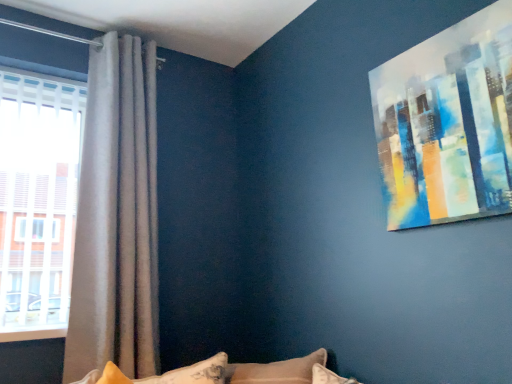
Question: Would you say acrylic painting at upper right is to the left or to the right of fluffy white pillow at lower center in the picture?

Choices:
 (A) left
 (B) right

Answer: (B)

Question: From the image's perspective, is acrylic painting at upper right located above or below fluffy white pillow at lower center?

Choices:
 (A) below
 (B) above

Answer: (B)

Question: Which is farther from the acrylic painting at upper right?

Choices:
 (A) fluffy white pillow at lower center
 (B) satin grey curtain at left

Answer: (B)

Question: Which object is positioned farthest from the acrylic painting at upper right?

Choices:
 (A) fluffy white pillow at lower center
 (B) satin grey curtain at left

Answer: (B)